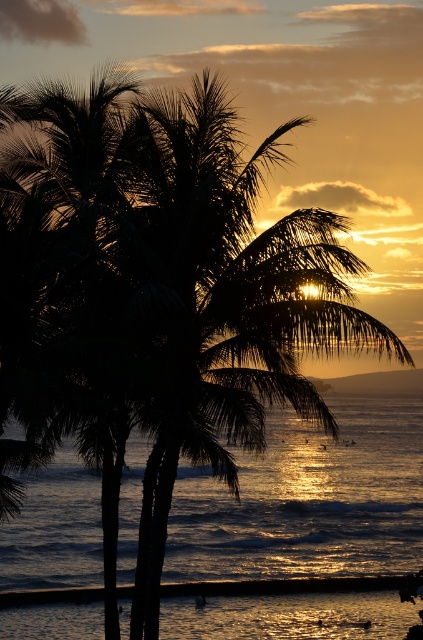
Question: Which of the following is the closest to the observer?

Choices:
 (A) (71, 452)
 (B) (357, 586)

Answer: (B)

Question: Does shiny golden water at center have a larger size compared to smooth sand at lower center?

Choices:
 (A) no
 (B) yes

Answer: (B)

Question: Is shiny golden water at center bigger than smooth sand at lower center?

Choices:
 (A) yes
 (B) no

Answer: (A)

Question: Is the position of shiny golden water at center less distant than that of smooth sand at lower center?

Choices:
 (A) yes
 (B) no

Answer: (B)